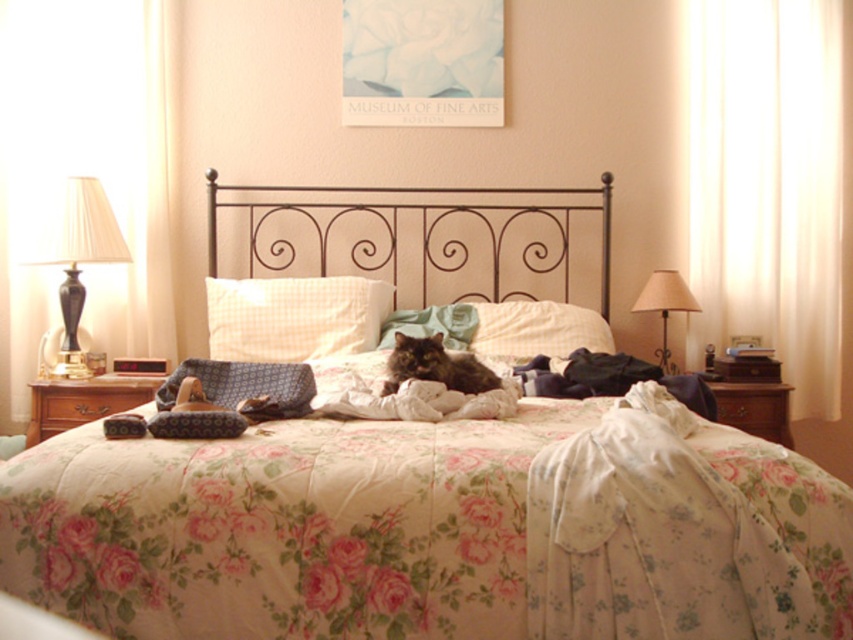
Can you confirm if floral cotton bedspread at center is wider than iron/metallic headboard at center?

In fact, floral cotton bedspread at center might be narrower than iron/metallic headboard at center.

Is point (334, 541) behind point (601, 196)?

No, (334, 541) is closer to viewer.

Identify the location of floral cotton bedspread at center. (428, 531).

Who is positioned more to the left, floral cotton blanket at center or iron/metallic headboard at center?

Positioned to the left is iron/metallic headboard at center.

From the picture: Is floral cotton blanket at center above iron/metallic headboard at center?

Actually, floral cotton blanket at center is below iron/metallic headboard at center.

This screenshot has width=853, height=640. Describe the element at coordinates (683, 532) in the screenshot. I see `floral cotton blanket at center` at that location.

The image size is (853, 640). I want to click on floral cotton blanket at center, so click(x=683, y=532).

Does iron/metallic headboard at center have a greater height compared to beige fabric lampshade at right?

Indeed, iron/metallic headboard at center has a greater height compared to beige fabric lampshade at right.

Based on the photo, which of these two, iron/metallic headboard at center or beige fabric lampshade at right, stands taller?

iron/metallic headboard at center

Which is behind, point (440, 262) or point (660, 360)?

The point (440, 262) is behind.

Locate an element on the screen. The height and width of the screenshot is (640, 853). iron/metallic headboard at center is located at coordinates tap(421, 237).